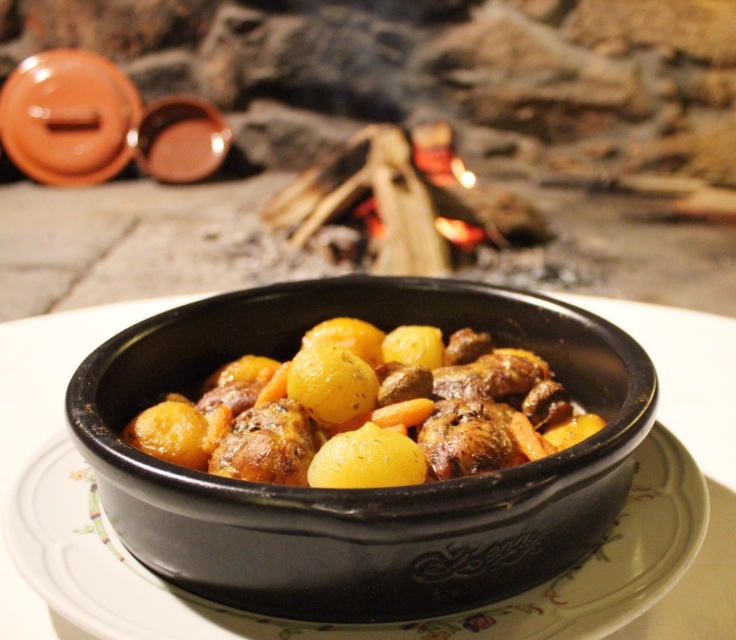
You are standing in front of the rustic meal scene. There are two points marked in the image. The first point is at coordinate point (431,568) and the second is at point (431,451). Which of these two points is nearer to you?

Point (431,568) is closer to the viewer than point (431,451).

You are setting up a picnic and have a black ceramic bowl at center and golden brown glazed meat and vegetables at center in front of you. Which item is located to the left?

The black ceramic bowl at center is positioned on the left side of golden brown glazed meat and vegetables at center, so the black ceramic bowl at center is to the left.